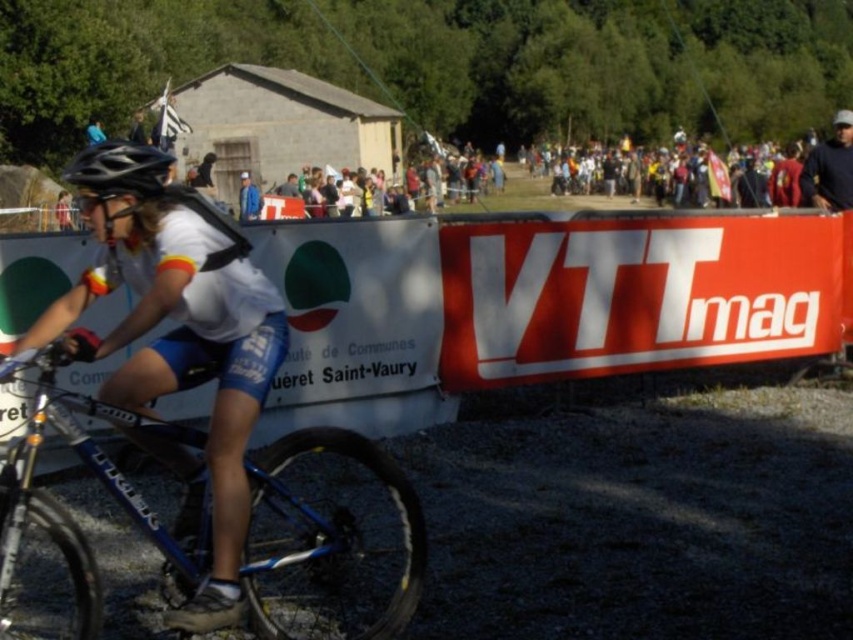
Between point (68, 170) and point (843, 180), which one is positioned in front?

Point (68, 170) is more forward.

Can you confirm if black matte helmet at center is positioned above dark blue shirt at upper right?

Actually, black matte helmet at center is below dark blue shirt at upper right.

Which is behind, point (109, 195) or point (816, 172)?

The point (816, 172) is more distant.

Identify the location of black matte helmet at center. (119, 170).

Between blue metallic bicycle at center and dark blue shirt at upper right, which one is positioned lower?

Positioned lower is blue metallic bicycle at center.

Is blue metallic bicycle at center in front of dark blue shirt at upper right?

Yes.

Identify the location of blue metallic bicycle at center. (329, 540).

Which is behind, point (273, 609) or point (91, 172)?

The point (273, 609) is behind.

Between blue metallic bicycle at center and black matte helmet at center, which one has less height?

blue metallic bicycle at center

Who is more distant from viewer, (135, 422) or (67, 164)?

Point (67, 164)

At what (x,y) coordinates should I click in order to perform the action: click on blue metallic bicycle at center. Please return your answer as a coordinate pair (x, y). The height and width of the screenshot is (640, 853). Looking at the image, I should click on (329, 540).